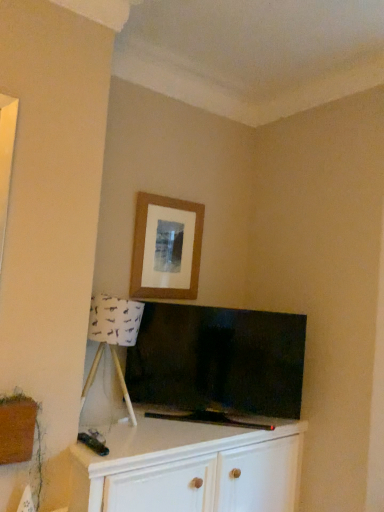
Locate an element on the screen. vacant point above white wood cabinet at lower center (from a real-world perspective) is located at coordinates (180, 429).